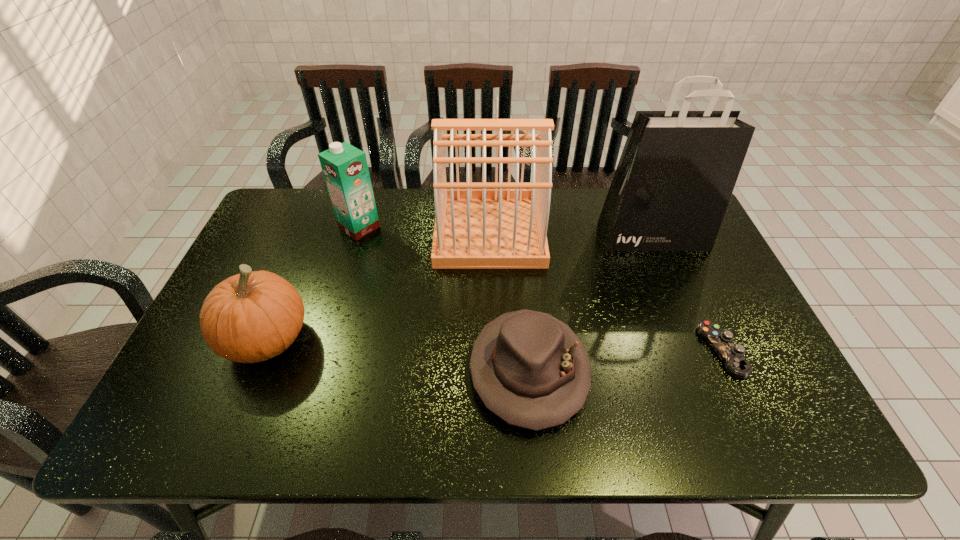
Where is `free space located 0.160m on the left of the fourth shortest object`? free space located 0.160m on the left of the fourth shortest object is located at coordinates (288, 227).

The image size is (960, 540). Find the location of `vacant space located 0.400m on the stem of the third shortest object`. vacant space located 0.400m on the stem of the third shortest object is located at coordinates (474, 339).

Locate an element on the screen. The image size is (960, 540). free region located 0.140m on the front of the shortest object is located at coordinates (762, 440).

Locate an element on the screen. This screenshot has height=540, width=960. shopping bag that is positioned at the far edge is located at coordinates (677, 171).

Identify the location of birdcage present at the far edge. The width and height of the screenshot is (960, 540). (478, 225).

Locate an element on the screen. This screenshot has width=960, height=540. carton present at the far edge is located at coordinates (345, 169).

This screenshot has height=540, width=960. I want to click on object that is at the near edge, so click(x=530, y=369).

Where is `object present at the left edge`? This screenshot has width=960, height=540. object present at the left edge is located at coordinates (251, 317).

Identify the location of shopping bag present at the right edge. The height and width of the screenshot is (540, 960). (677, 171).

What are the coordinates of `control that is at the right edge` in the screenshot? It's located at (731, 354).